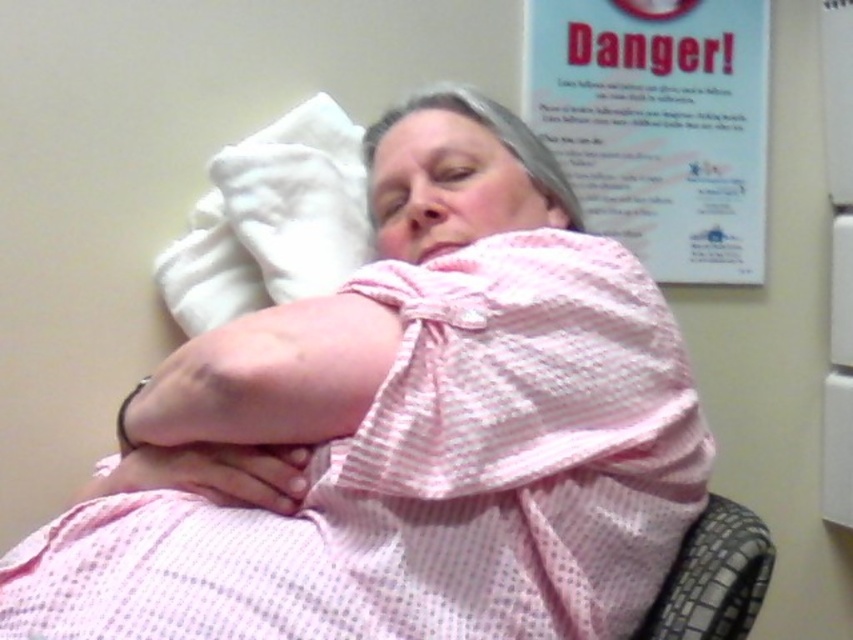
Does pink gingham hospital gown at center appear on the right side of black mesh chair at lower right?

Incorrect, pink gingham hospital gown at center is not on the right side of black mesh chair at lower right.

Locate an element on the screen. pink gingham hospital gown at center is located at coordinates (405, 432).

Locate an element on the screen. pink gingham hospital gown at center is located at coordinates (405, 432).

Is white paper at upper right to the left of black mesh chair at lower right from the viewer's perspective?

No, white paper at upper right is not to the left of black mesh chair at lower right.

Is white paper at upper right thinner than black mesh chair at lower right?

No, white paper at upper right is not thinner than black mesh chair at lower right.

Does point (679, 106) lie behind point (688, 620)?

Yes, it is behind point (688, 620).

Where is `white paper at upper right`? white paper at upper right is located at coordinates (659, 124).

Is point (439, 464) closer to camera compared to point (236, 147)?

Yes, it is in front of point (236, 147).

Describe the element at coordinates (405, 432) in the screenshot. This screenshot has height=640, width=853. I see `pink gingham hospital gown at center` at that location.

Which is behind, point (282, 436) or point (280, 244)?

Point (280, 244)

This screenshot has width=853, height=640. Identify the location of pink gingham hospital gown at center. (405, 432).